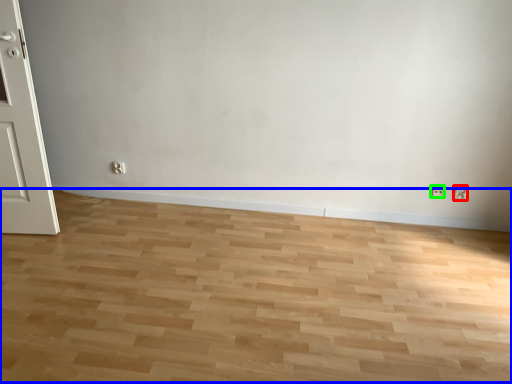
Question: Which is farther away from electric outlet (highlighted by a red box)? plain (highlighted by a blue box) or electric outlet (highlighted by a green box)?

Choices:
 (A) plain
 (B) electric outlet

Answer: (A)